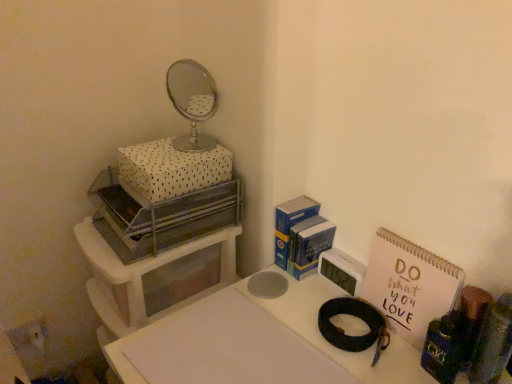
Measure the distance between point (132, 360) and camera.

33.98 inches.

Identify the location of pink paper notebook at right. (409, 285).

How much space does wooden cylindrical container at right, the first appliance when ordered from front to back, occupy vertically?

The height of wooden cylindrical container at right, the first appliance when ordered from front to back, is 21.75 centimeters.

This screenshot has width=512, height=384. I want to click on white plastic clock at center-right, which is the 1th appliance from back to front, so click(x=342, y=270).

What do you see at coordinates (160, 216) in the screenshot? This screenshot has width=512, height=384. I see `metallic silver tray at upper left, which is the 2th appliance in front-to-back order` at bounding box center [160, 216].

The height and width of the screenshot is (384, 512). Identify the location of shiny metallic magnifying glass at upper center. (356, 317).

Where is `white matte table at center`? The height and width of the screenshot is (384, 512). white matte table at center is located at coordinates (254, 343).

Looking at this image, from a real-world perspective, is metallic silver tray at upper left, acting as the 3th appliance starting from the right, beneath shiny metallic magnifying glass at upper center?

No, from a real-world perspective, metallic silver tray at upper left, acting as the 3th appliance starting from the right, is not under shiny metallic magnifying glass at upper center.

Is metallic silver tray at upper left, the 1th appliance when ordered from left to right, to the left or to the right of shiny metallic magnifying glass at upper center in the image?

In the image, metallic silver tray at upper left, the 1th appliance when ordered from left to right, appears on the left side of shiny metallic magnifying glass at upper center.

Looking at their sizes, would you say metallic silver tray at upper left, the 1th appliance when ordered from left to right, is wider or thinner than shiny metallic magnifying glass at upper center?

In the image, metallic silver tray at upper left, the 1th appliance when ordered from left to right, appears to be wider than shiny metallic magnifying glass at upper center.

Is metallic silver tray at upper left, which ranks as the 2th appliance in back-to-front order, oriented away from shiny metallic magnifying glass at upper center?

No, metallic silver tray at upper left, which ranks as the 2th appliance in back-to-front order, is not facing the opposite direction of shiny metallic magnifying glass at upper center.

How distant is shiny metallic magnifying glass at upper center from metallic silver tray at upper left, acting as the 3th appliance starting from the right?

shiny metallic magnifying glass at upper center is 45.88 centimeters away from metallic silver tray at upper left, acting as the 3th appliance starting from the right.

Is shiny metallic magnifying glass at upper center not close to metallic silver tray at upper left, acting as the 3th appliance starting from the right?

No.

Which is more to the left, shiny metallic magnifying glass at upper center or metallic silver tray at upper left, which is the 2th appliance in front-to-back order?

From the viewer's perspective, metallic silver tray at upper left, which is the 2th appliance in front-to-back order, appears more on the left side.

From a real-world perspective, who is located higher, shiny metallic magnifying glass at upper center or metallic silver tray at upper left, the 1th appliance when ordered from left to right?

From a 3D spatial view, metallic silver tray at upper left, the 1th appliance when ordered from left to right, is above.

From the picture: Are white matte table at center and white plastic storage unit at left making contact?

No, white matte table at center is not in contact with white plastic storage unit at left.

Image resolution: width=512 pixels, height=384 pixels. In order to click on table below the white plastic storage unit at left (from a real-world perspective) in this screenshot , I will do `click(254, 343)`.

Based on the photo, what's the angular difference between white matte table at center and white plastic storage unit at left's facing directions?

They differ by 0.632 degrees in their facing directions.

Is white matte table at center not inside white plastic storage unit at left?

white matte table at center lies outside white plastic storage unit at left's area.

Considering the sizes of objects white plastic clock at center-right, which is the third appliance from front to back, and white matte table at center in the image provided, who is smaller, white plastic clock at center-right, which is the third appliance from front to back, or white matte table at center?

Smaller between the two is white plastic clock at center-right, which is the third appliance from front to back.

From the image's perspective, would you say white plastic clock at center-right, the second appliance viewed from the right, is positioned over white matte table at center?

Yes, from the image's perspective, white plastic clock at center-right, the second appliance viewed from the right, is over white matte table at center.

Is the surface of white plastic clock at center-right, which is the 1th appliance from back to front, in direct contact with white matte table at center?

No, white plastic clock at center-right, which is the 1th appliance from back to front, is not in contact with white matte table at center.

I want to click on appliance that is the 1st object above the pink paper notebook at right (from a real-world perspective), so click(x=493, y=342).

Which object is more forward, wooden cylindrical container at right, which is counted as the 3th appliance, starting from the back, or pink paper notebook at right?

wooden cylindrical container at right, which is counted as the 3th appliance, starting from the back, is in front.

From the picture: Would you say wooden cylindrical container at right, which is counted as the 3th appliance, starting from the back, contains pink paper notebook at right?

No, pink paper notebook at right is located outside of wooden cylindrical container at right, which is counted as the 3th appliance, starting from the back.

Is point (495, 335) closer or farther from the camera than point (420, 333)?

Point (495, 335).

From the picture: Who is taller, white plastic storage unit at left or white matte table at center?

With more height is white plastic storage unit at left.

Is white plastic storage unit at left in contact with white matte table at center?

white plastic storage unit at left and white matte table at center are clearly separated.

Between white plastic storage unit at left and white matte table at center, which one has smaller width?

white plastic storage unit at left is thinner.

Considering the sizes of objects wooden cylindrical container at right, the 1th appliance when ordered from right to left, and metallic silver tray at upper left, acting as the 3th appliance starting from the right, in the image provided, who is wider, wooden cylindrical container at right, the 1th appliance when ordered from right to left, or metallic silver tray at upper left, acting as the 3th appliance starting from the right,?

Wider between the two is metallic silver tray at upper left, acting as the 3th appliance starting from the right.

Is wooden cylindrical container at right, acting as the third appliance starting from the left, spatially inside metallic silver tray at upper left, which is the 2th appliance in front-to-back order, or outside of it?

wooden cylindrical container at right, acting as the third appliance starting from the left, is not inside metallic silver tray at upper left, which is the 2th appliance in front-to-back order, it's outside.

Consider the image. From the image's perspective, is wooden cylindrical container at right, acting as the third appliance starting from the left, located beneath metallic silver tray at upper left, the 1th appliance when ordered from left to right?

Yes, from the image's perspective, wooden cylindrical container at right, acting as the third appliance starting from the left, is below metallic silver tray at upper left, the 1th appliance when ordered from left to right.

I want to click on magnifying glass on the right of metallic silver tray at upper left, the 1th appliance when ordered from left to right, so click(356, 317).

Where is `the 1st appliance behind the shiny metallic magnifying glass at upper center`? The image size is (512, 384). the 1st appliance behind the shiny metallic magnifying glass at upper center is located at coordinates [x=160, y=216].

Looking at the image, which one is located further to white dotted fabric box at upper left, white plastic storage unit at left or wooden cylindrical container at right, the first appliance when ordered from front to back?

Among the two, wooden cylindrical container at right, the first appliance when ordered from front to back, is located further to white dotted fabric box at upper left.

Based on their spatial positions, is pink paper notebook at right or white dotted fabric box at upper left further from white plastic clock at center-right, which is the 1th appliance from back to front?

The object further to white plastic clock at center-right, which is the 1th appliance from back to front, is white dotted fabric box at upper left.

When comparing their distances from metallic silver tray at upper left, which is the 2th appliance in front-to-back order, does white plastic clock at center-right, which is the third appliance from front to back, or pink paper notebook at right seem closer?

white plastic clock at center-right, which is the third appliance from front to back, is closer to metallic silver tray at upper left, which is the 2th appliance in front-to-back order.

From the image, which object appears to be farther from white plastic clock at center-right, the second appliance viewed from the right, shiny metallic magnifying glass at upper center or white dotted fabric box at upper left?

Based on the image, white dotted fabric box at upper left appears to be further to white plastic clock at center-right, the second appliance viewed from the right.

When comparing their distances from white plastic clock at center-right, which is the third appliance from front to back, does white dotted fabric box at upper left or white plastic storage unit at left seem further?

Based on the image, white plastic storage unit at left appears to be further to white plastic clock at center-right, which is the third appliance from front to back.

When comparing their distances from white plastic storage unit at left, does white dotted fabric box at upper left or wooden cylindrical container at right, which is counted as the 3th appliance, starting from the back, seem further?

The object further to white plastic storage unit at left is wooden cylindrical container at right, which is counted as the 3th appliance, starting from the back.

Based on their spatial positions, is wooden cylindrical container at right, the 1th appliance when ordered from right to left, or white plastic clock at center-right, which is the 1th appliance from back to front, closer to shiny metallic magnifying glass at upper center?

white plastic clock at center-right, which is the 1th appliance from back to front, is positioned closer to the anchor shiny metallic magnifying glass at upper center.

Estimate the real-world distances between objects in this image. Which object is further from white dotted fabric box at upper left, metallic silver tray at upper left, the 1th appliance when ordered from left to right, or pink paper notebook at right?

Among the two, pink paper notebook at right is located further to white dotted fabric box at upper left.

The image size is (512, 384). Find the location of `furniture between white matte table at center and white plastic clock at center-right, which ranks as the second appliance in left-to-right order, from front to back`. furniture between white matte table at center and white plastic clock at center-right, which ranks as the second appliance in left-to-right order, from front to back is located at coordinates (143, 276).

What are the coordinates of `notebook between white matte table at center and white plastic clock at center-right, which is the 1th appliance from back to front, along the z-axis` in the screenshot? It's located at (409, 285).

Image resolution: width=512 pixels, height=384 pixels. Find the location of `table between white plastic storage unit at left and pink paper notebook at right in the horizontal direction`. table between white plastic storage unit at left and pink paper notebook at right in the horizontal direction is located at coordinates (254, 343).

In order to click on furniture between metallic silver tray at upper left, which is the 2th appliance in front-to-back order, and white matte table at center in the up-down direction in this screenshot , I will do `click(143, 276)`.